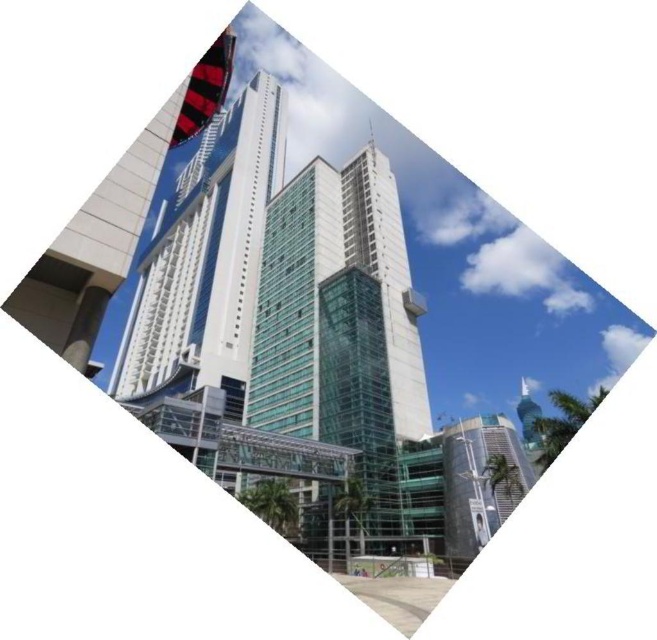
Between white glass building at center and glassy teal skyscraper at lower right, which one appears on the right side from the viewer's perspective?

From the viewer's perspective, glassy teal skyscraper at lower right appears more on the right side.

Locate an element on the screen. white glass building at center is located at coordinates (204, 280).

Between point (143, 337) and point (453, 480), which one is positioned in front?

Point (453, 480) is more forward.

Image resolution: width=657 pixels, height=640 pixels. Find the location of `white glass building at center`. white glass building at center is located at coordinates coord(204,280).

Can you confirm if transparent glass tower at center is positioned below white glass building at center?

Correct, transparent glass tower at center is located below white glass building at center.

Which is above, transparent glass tower at center or white glass building at center?

white glass building at center

At what (x,y) coordinates should I click in order to perform the action: click on transparent glass tower at center. Please return your answer as a coordinate pair (x, y). The width and height of the screenshot is (657, 640). Looking at the image, I should click on (342, 336).

Who is higher up, transparent glass tower at center or glassy teal skyscraper at lower right?

transparent glass tower at center is above.

Does transparent glass tower at center have a larger size compared to glassy teal skyscraper at lower right?

Indeed, transparent glass tower at center has a larger size compared to glassy teal skyscraper at lower right.

Which is behind, point (346, 323) or point (466, 433)?

Positioned behind is point (346, 323).

You are a GUI agent. You are given a task and a screenshot of the screen. Output one action in this format:
    pyautogui.click(x=<x>, y=<y>)
    Task: Click on the transparent glass tower at center
    
    Given the screenshot: What is the action you would take?
    pyautogui.click(x=342, y=336)